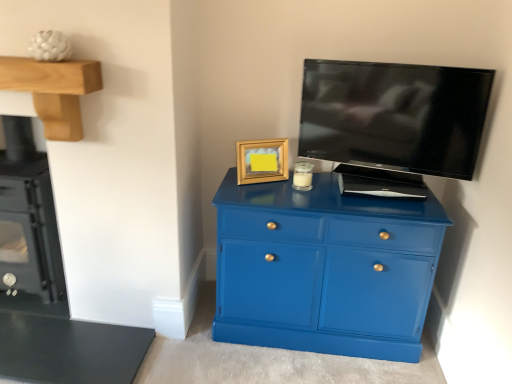
Identify the location of gold wooden picture frame at upper center. (262, 161).

Image resolution: width=512 pixels, height=384 pixels. What do you see at coordinates (262, 161) in the screenshot? I see `gold wooden picture frame at upper center` at bounding box center [262, 161].

Image resolution: width=512 pixels, height=384 pixels. What do you see at coordinates (303, 176) in the screenshot?
I see `translucent glass candle at center` at bounding box center [303, 176].

The height and width of the screenshot is (384, 512). What do you see at coordinates (394, 117) in the screenshot?
I see `black glossy tv at upper right` at bounding box center [394, 117].

At what (x,y) coordinates should I click in order to perform the action: click on black glossy tv at upper right. Please return your answer as a coordinate pair (x, y). The width and height of the screenshot is (512, 384). Looking at the image, I should click on (394, 117).

The image size is (512, 384). Find the location of `black glass stove at left`. black glass stove at left is located at coordinates (28, 218).

This screenshot has height=384, width=512. Identify the location of candle holder below the gold wooden picture frame at upper center (from the image's perspective). (303, 176).

Is gold wooden picture frame at upper center at the left side of translucent glass candle at center?

Correct, you'll find gold wooden picture frame at upper center to the left of translucent glass candle at center.

Is gold wooden picture frame at upper center facing towards translucent glass candle at center?

No, gold wooden picture frame at upper center is not aimed at translucent glass candle at center.

Could you measure the distance between gold wooden picture frame at upper center and translucent glass candle at center?

A distance of 6.09 inches exists between gold wooden picture frame at upper center and translucent glass candle at center.

Is black glossy tv at upper right not near black glass stove at left?

black glossy tv at upper right is far away from black glass stove at left.

Which is more to the right, black glossy tv at upper right or black glass stove at left?

black glossy tv at upper right.

Is black glossy tv at upper right oriented away from black glass stove at left?

That's not correct — black glossy tv at upper right is not looking away from black glass stove at left.

This screenshot has height=384, width=512. What are the coordinates of `television in front of the black glass stove at left` in the screenshot? It's located at (394, 117).

Is the depth of black glossy tv at upper right less than that of wooden mantel at upper left?

No, black glossy tv at upper right is further to the viewer.

Is point (385, 95) positioned behind point (52, 67)?

Yes, point (385, 95) is behind point (52, 67).

Is black glossy tv at upper right facing away from wooden mantel at upper left?

No, black glossy tv at upper right is not facing away from wooden mantel at upper left.

From a real-world perspective, is black glossy tv at upper right physically above wooden mantel at upper left?

Actually, black glossy tv at upper right is physically below wooden mantel at upper left in the real world.

Based on the photo, can you confirm if glossy blue cabinet at center is positioned to the left of wooden mantel at upper left?

In fact, glossy blue cabinet at center is to the right of wooden mantel at upper left.

Can you confirm if glossy blue cabinet at center is bigger than wooden mantel at upper left?

Correct, glossy blue cabinet at center is larger in size than wooden mantel at upper left.

Would you say glossy blue cabinet at center is inside or outside wooden mantel at upper left?

The correct answer is: outside.

Consider the image. From a real-world perspective, is glossy blue cabinet at center on top of wooden mantel at upper left?

No.

Is glossy blue cabinet at center not near black glass stove at left?

Yes, glossy blue cabinet at center and black glass stove at left are quite far apart.

From the image's perspective, is glossy blue cabinet at center positioned above or below black glass stove at left?

From the image's perspective, glossy blue cabinet at center appears below black glass stove at left.

Is black glass stove at left inside glossy blue cabinet at center?

No, black glass stove at left is not a part of glossy blue cabinet at center.

Is glossy blue cabinet at center looking in the opposite direction of black glass stove at left?

That's not correct — glossy blue cabinet at center is not looking away from black glass stove at left.

Is point (326, 243) behind point (259, 160)?

No, it is not.

Who is smaller, glossy blue cabinet at center or gold wooden picture frame at upper center?

gold wooden picture frame at upper center is smaller.

Is glossy blue cabinet at center positioned with its back to gold wooden picture frame at upper center?

glossy blue cabinet at center is not turned away from gold wooden picture frame at upper center.

Are glossy blue cabinet at center and gold wooden picture frame at upper center beside each other?

No, glossy blue cabinet at center is not beside gold wooden picture frame at upper center.

In terms of height, does black glass stove at left look taller or shorter compared to translucent glass candle at center?

Considering their sizes, black glass stove at left has more height than translucent glass candle at center.

How different are the orientations of black glass stove at left and translucent glass candle at center in degrees?

There is a 3.2-degree angle between the facing directions of black glass stove at left and translucent glass candle at center.

The height and width of the screenshot is (384, 512). I want to click on appliance lying on the left of translucent glass candle at center, so click(x=28, y=218).

Is black glass stove at left turned away from translucent glass candle at center?

No, translucent glass candle at center is not at the back of black glass stove at left.

Where is `candle holder that appears below the gold wooden picture frame at upper center (from a real-world perspective)`? This screenshot has height=384, width=512. candle holder that appears below the gold wooden picture frame at upper center (from a real-world perspective) is located at coordinates (303, 176).

Find the location of a particular element. This screenshot has width=512, height=384. appliance that is behind the black glossy tv at upper right is located at coordinates (28, 218).

When comparing their distances from translucent glass candle at center, does glossy blue cabinet at center or black glossy tv at upper right seem closer?

Among the two, black glossy tv at upper right is located nearer to translucent glass candle at center.

Estimate the real-world distances between objects in this image. Which object is closer to glossy blue cabinet at center, translucent glass candle at center or gold wooden picture frame at upper center?

gold wooden picture frame at upper center lies closer to glossy blue cabinet at center than the other object.

Which object lies nearer to the anchor point glossy blue cabinet at center, wooden mantel at upper left or gold wooden picture frame at upper center?

gold wooden picture frame at upper center is positioned closer to the anchor glossy blue cabinet at center.

Looking at the image, which one is located further to wooden mantel at upper left, gold wooden picture frame at upper center or black glass stove at left?

gold wooden picture frame at upper center lies further to wooden mantel at upper left than the other object.

Which object lies further to the anchor point translucent glass candle at center, gold wooden picture frame at upper center or wooden mantel at upper left?

wooden mantel at upper left.

Based on the photo, when comparing their distances from wooden mantel at upper left, does black glass stove at left or glossy blue cabinet at center seem closer?

black glass stove at left.

Which object lies further to the anchor point black glossy tv at upper right, wooden mantel at upper left or black glass stove at left?

Among the two, black glass stove at left is located further to black glossy tv at upper right.

Estimate the real-world distances between objects in this image. Which object is closer to gold wooden picture frame at upper center, black glossy tv at upper right or glossy blue cabinet at center?

The object closer to gold wooden picture frame at upper center is glossy blue cabinet at center.

The image size is (512, 384). I want to click on the chest of drawers located between wooden mantel at upper left and black glossy tv at upper right in the left-right direction, so click(324, 269).

I want to click on picture frame between black glossy tv at upper right and glossy blue cabinet at center from top to bottom, so click(262, 161).

Locate an element on the screen. The width and height of the screenshot is (512, 384). picture frame between wooden mantel at upper left and translucent glass candle at center from left to right is located at coordinates (262, 161).

Where is `candle holder between gold wooden picture frame at upper center and glossy blue cabinet at center from top to bottom`? The image size is (512, 384). candle holder between gold wooden picture frame at upper center and glossy blue cabinet at center from top to bottom is located at coordinates (303, 176).